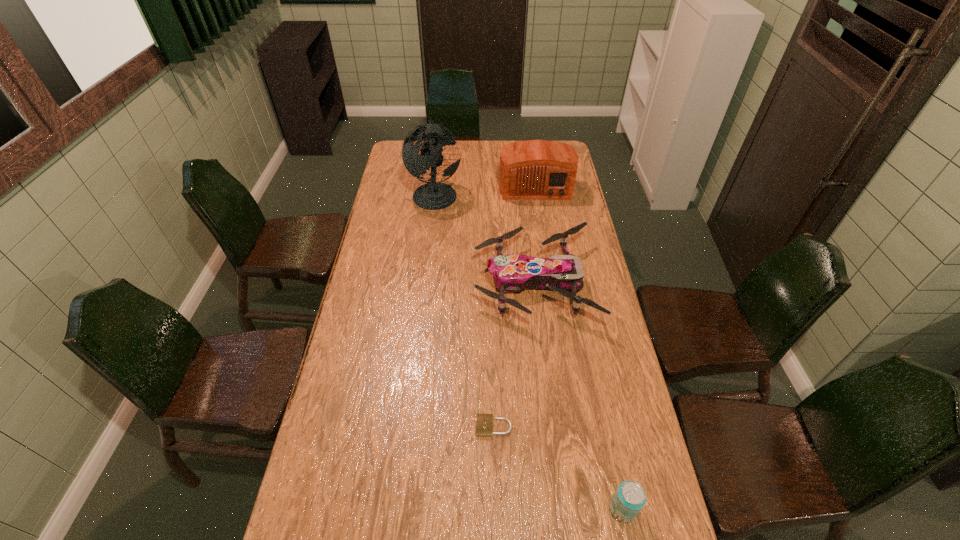
Locate an element on the screen. The width and height of the screenshot is (960, 540). the tallest object is located at coordinates (434, 195).

The image size is (960, 540). What are the coordinates of `the leftmost object` in the screenshot? It's located at (434, 195).

The width and height of the screenshot is (960, 540). Identify the location of radio receiver. (534, 169).

Where is `beer can`? beer can is located at coordinates click(x=629, y=499).

Identify the location of the third farthest object. (512, 273).

Locate an element on the screen. Image resolution: width=960 pixels, height=540 pixels. the fourth farthest object is located at coordinates point(484,422).

The height and width of the screenshot is (540, 960). What are the coordinates of `padlock` in the screenshot? It's located at (484, 422).

The image size is (960, 540). I want to click on vacant space located 0.150m on the front-facing side of the leftmost object, so click(x=495, y=193).

Find the location of `vacant space located 0.370m on the front-facing side of the radio receiver`. vacant space located 0.370m on the front-facing side of the radio receiver is located at coordinates (547, 262).

You are a GUI agent. You are given a task and a screenshot of the screen. Output one action in this format:
    pyautogui.click(x=<x>, y=<y>)
    Task: Click on the free space located 0.160m on the back of the beer can
    This screenshot has height=540, width=960.
    Given the screenshot: What is the action you would take?
    pyautogui.click(x=607, y=433)